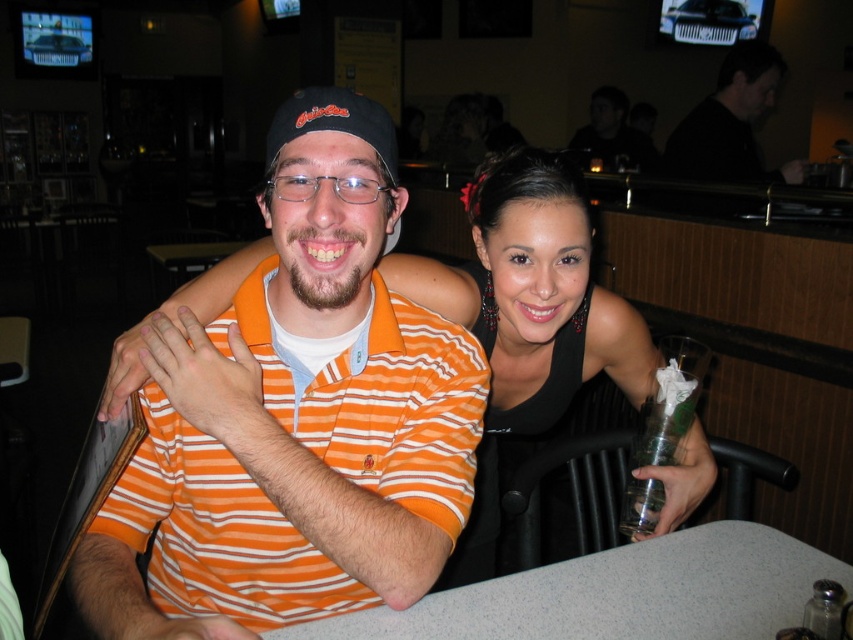
Question: Which object appears closest to the camera in this image?

Choices:
 (A) orange striped polo shirt at center
 (B) dark matte shirt at upper right
 (C) clear glass salt shaker at lower right
 (D) gray speckled table at lower center

Answer: (A)

Question: Which object is farther from the camera taking this photo?

Choices:
 (A) gray speckled table at lower center
 (B) clear glass salt shaker at lower right

Answer: (A)

Question: Which of the following is the farthest from the observer?

Choices:
 (A) gray speckled table at lower center
 (B) black matte shirt at upper right
 (C) clear glass salt shaker at lower right
 (D) orange striped polo shirt at center

Answer: (B)

Question: In this image, where is black matte shirt at upper right located relative to clear glass salt shaker at lower right?

Choices:
 (A) above
 (B) below

Answer: (A)

Question: Is orange striped polo shirt at center wider than clear glass salt shaker at lower right?

Choices:
 (A) no
 (B) yes

Answer: (B)

Question: Does black matte shirt at upper right appear over dark matte shirt at upper right?

Choices:
 (A) no
 (B) yes

Answer: (A)